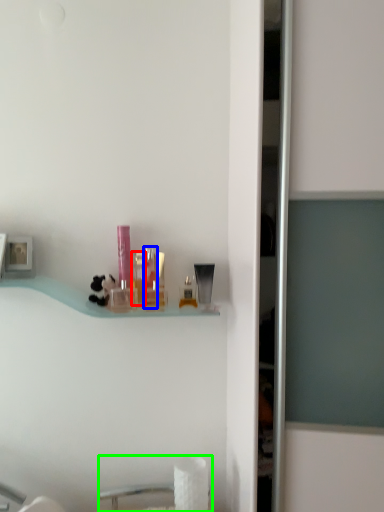
Question: Considering the real-world distances, which object is farthest from toiletry (highlighted by a red box)? toiletry (highlighted by a blue box) or sink (highlighted by a green box)?

Choices:
 (A) toiletry
 (B) sink

Answer: (B)